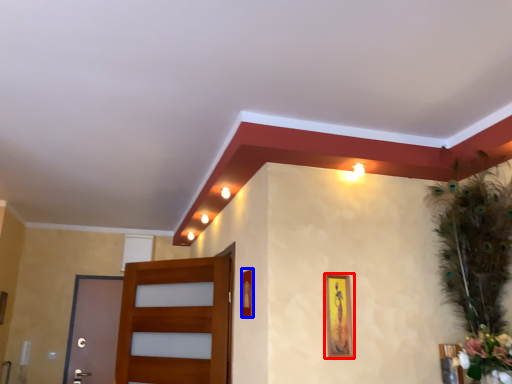
Question: Which object is closer to the camera taking this photo, picture frame (highlighted by a red box) or picture frame (highlighted by a blue box)?

Choices:
 (A) picture frame
 (B) picture frame

Answer: (A)